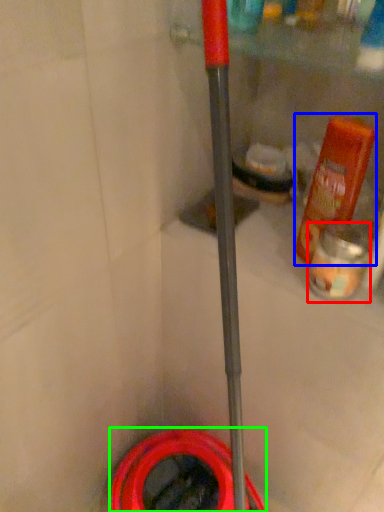
Question: Which is farther away from cleaning product (highlighted by a red box)? bottle (highlighted by a blue box) or garden hose (highlighted by a green box)?

Choices:
 (A) bottle
 (B) garden hose

Answer: (B)